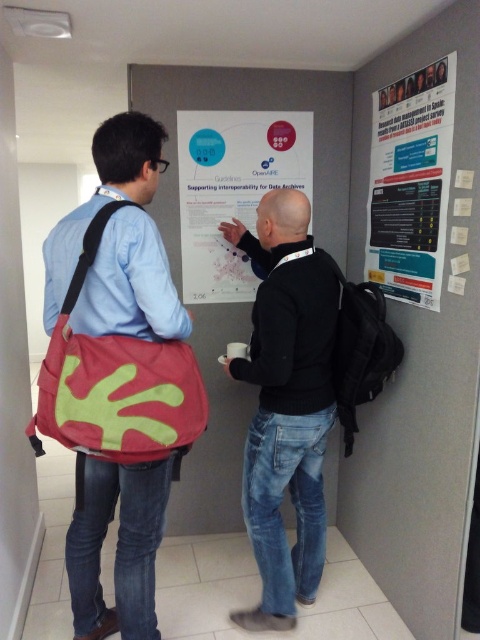
Question: Which object is the closest to the matte paper poster at center?

Choices:
 (A) white paper at upper right
 (B) black matte jacket at center
 (C) matte fabric bag at left

Answer: (A)

Question: Which object is farther from the camera taking this photo?

Choices:
 (A) white paper at upper right
 (B) matte fabric bag at left

Answer: (A)

Question: Is matte fabric bag at left above matte paper poster at center?

Choices:
 (A) no
 (B) yes

Answer: (A)

Question: In this image, where is matte fabric bag at left located relative to black matte jacket at center?

Choices:
 (A) right
 (B) left

Answer: (B)

Question: Which object is the closest to the matte fabric bag at left?

Choices:
 (A) white paper at upper right
 (B) black matte jacket at center
 (C) matte paper poster at center

Answer: (B)

Question: Can you confirm if black matte jacket at center is thinner than white paper at upper right?

Choices:
 (A) no
 (B) yes

Answer: (A)